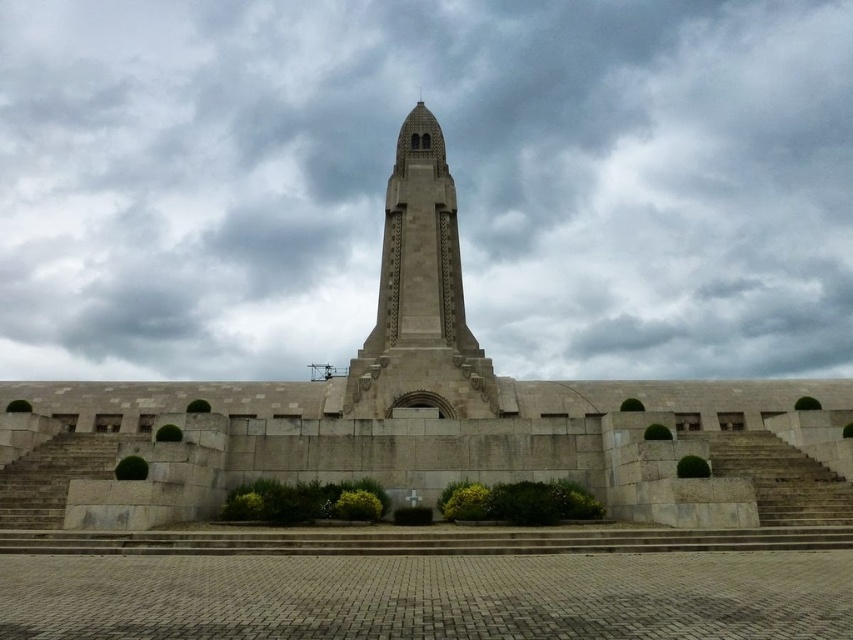
Describe the element at coordinates (450, 170) in the screenshot. I see `gray cloudy sky at center` at that location.

Locate an element on the screen. The image size is (853, 640). gray cloudy sky at center is located at coordinates (450, 170).

Can you confirm if beige stone bell tower at center is smaller than gray stone stairs at center?

Actually, beige stone bell tower at center might be larger than gray stone stairs at center.

Who is more distant from viewer, (439, 288) or (749, 458)?

The point (439, 288) is more distant.

Identify the location of beige stone bell tower at center. The image size is (853, 640). (421, 296).

At what (x,y) coordinates should I click in order to perform the action: click on gray stone stairs at center. Please return your answer as a coordinate pair (x, y). Looking at the image, I should click on (779, 477).

What do you see at coordinates (779, 477) in the screenshot? The image size is (853, 640). I see `gray stone stairs at center` at bounding box center [779, 477].

Is point (747, 436) less distant than point (112, 467)?

No, (747, 436) is further to viewer.

Where is `gray stone stairs at center`? The width and height of the screenshot is (853, 640). gray stone stairs at center is located at coordinates (779, 477).